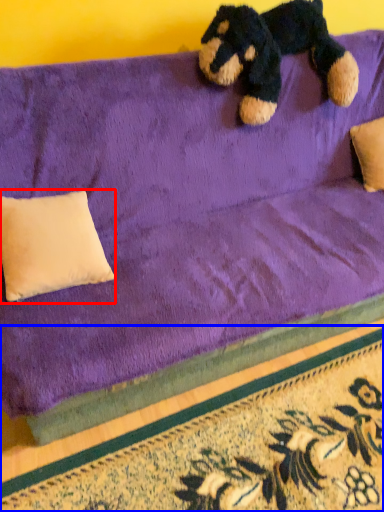
Question: Among these objects, which one is farthest to the camera, pillow (highlighted by a red box) or doormat (highlighted by a blue box)?

Choices:
 (A) pillow
 (B) doormat

Answer: (A)